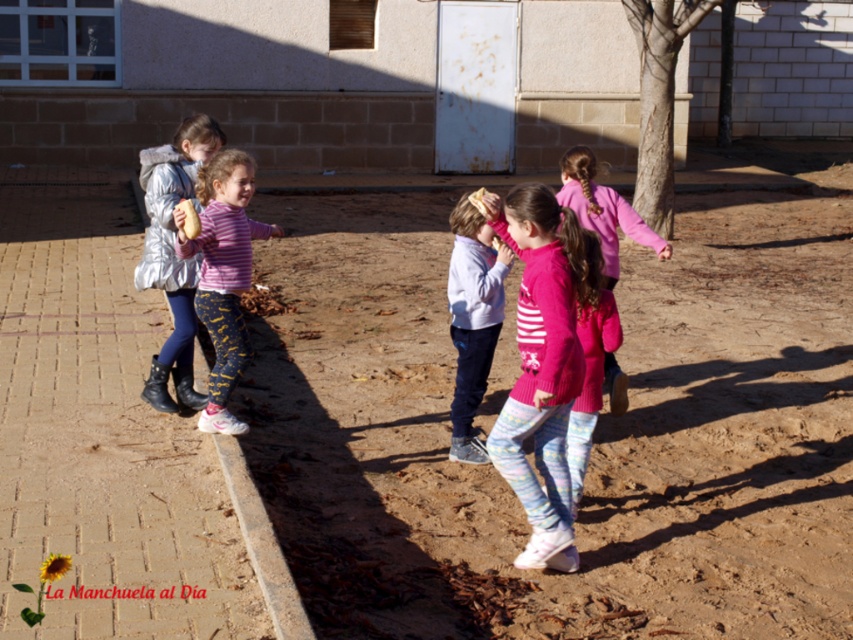
You are a photographer trying to capture the entire scene of the brown sandy ground at center and the silver metallic jacket at left. Since the camera has a limited field of view, which object should you focus on to ensure both are visible without zooming in?

The brown sandy ground at center is bigger than the silver metallic jacket at left, so focusing on the brown sandy ground at center would allow both objects to fit within the camera frame without zooming in.

You are standing in the schoolyard and see two points marked in the image. Which point, point [229,349] or point [479,333], is closer to you?

Point [229,349] is closer to you than point [479,333].

You are standing in the schoolyard and want to locate the brown sandy ground at center. According to the coordinates provided, which point on the map corresponds to its location?

The brown sandy ground at center is located at point (593, 435).